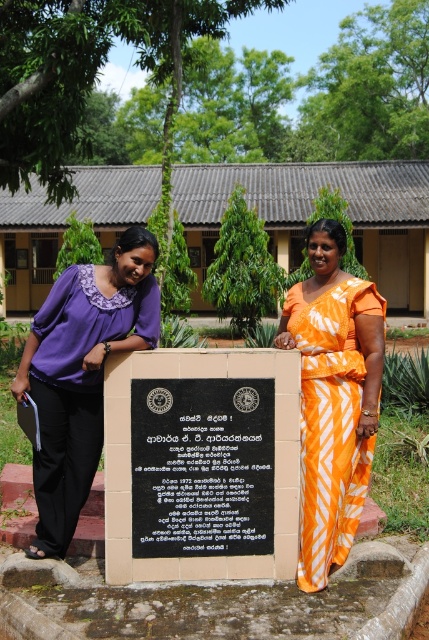
You are a photographer standing at the camera position. You want to take a photo of the purple fabric blouse at left without including the plaque. Can you step back to achieve this?

The distance between the purple fabric blouse at left and the camera is 3.93 meters. Since the plaque is between the blouse and the camera, stepping back would not exclude the plaque from the frame. You need to move sideways or adjust the angle instead.

You are a visitor at the schoolyard and want to take a photo of the black stone plaque at center without the purple fabric blouse at left appearing in the frame. How should you adjust your camera angle?

Since the black stone plaque at center is positioned under the purple fabric blouse at left, you can lower your camera angle to capture the plaque while avoiding the blouse in the frame.